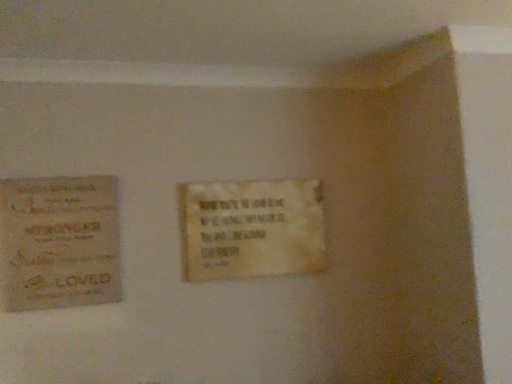
Question: Is matte paper poster at left taller or shorter than white paper plaque at center?

Choices:
 (A) tall
 (B) short

Answer: (A)

Question: From the image's perspective, is matte paper poster at left located above or below white paper plaque at center?

Choices:
 (A) below
 (B) above

Answer: (A)

Question: Considering the positions of point (93, 302) and point (308, 223), is point (93, 302) closer or farther from the camera than point (308, 223)?

Choices:
 (A) farther
 (B) closer

Answer: (B)

Question: Considering the positions of white paper plaque at center and matte paper poster at left in the image, is white paper plaque at center bigger or smaller than matte paper poster at left?

Choices:
 (A) small
 (B) big

Answer: (B)

Question: In terms of height, does white paper plaque at center look taller or shorter compared to matte paper poster at left?

Choices:
 (A) tall
 (B) short

Answer: (B)

Question: Relative to matte paper poster at left, is white paper plaque at center in front or behind?

Choices:
 (A) front
 (B) behind

Answer: (B)

Question: Considering the positions of point click(254, 218) and point click(48, 271), is point click(254, 218) closer or farther from the camera than point click(48, 271)?

Choices:
 (A) farther
 (B) closer

Answer: (A)